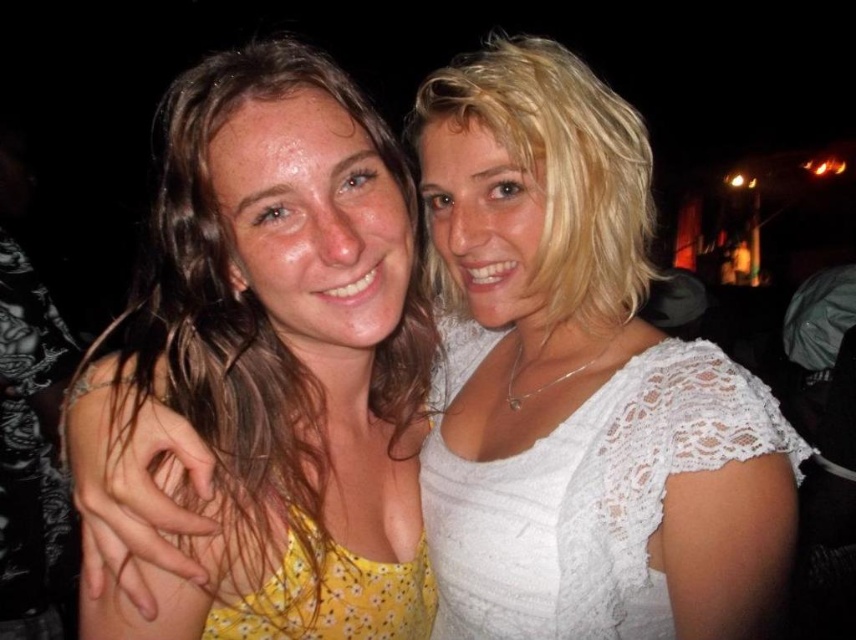
From the picture: You are a photographer setting up for a group photo. You have two dresses in the scene, the yellow floral dress at center and the white lace dress at right. The minimum distance required between subjects for clear focus is 20 centimeters. Will the current positioning allow for clear focus on both dresses?

The yellow floral dress at center is 19.66 centimeters away from the white lace dress at right, which is less than the required 20 centimeters. Therefore, the current positioning may not allow for clear focus on both dresses due to the insufficient distance between them.

You are a photographer trying to position two models for a night photo shoot. The scene requires the yellow floral dress at center and the white lace dress at right to be arranged in a specific way. Based on the provided image, which dress is positioned to the left of the other?

The yellow floral dress at center is positioned to the left of the white lace dress at right.

You are a photographer trying to decide where to place two dresses in a photo shoot. The yellow floral dress at center is wider than the white lace dress at right. If you want to ensure both dresses are visible without overlapping, which dress should be placed to the left to accommodate their widths?

Since the yellow floral dress at center is wider than the white lace dress at right, placing the wider yellow floral dress at center on the left would allow more space for both dresses to be visible without overlapping.